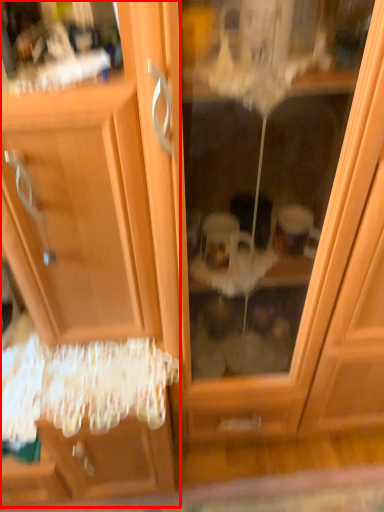
Question: From the image's perspective, what is the correct spatial positioning of dresser (annotated by the red box) in reference to screen door?

Choices:
 (A) below
 (B) above

Answer: (A)